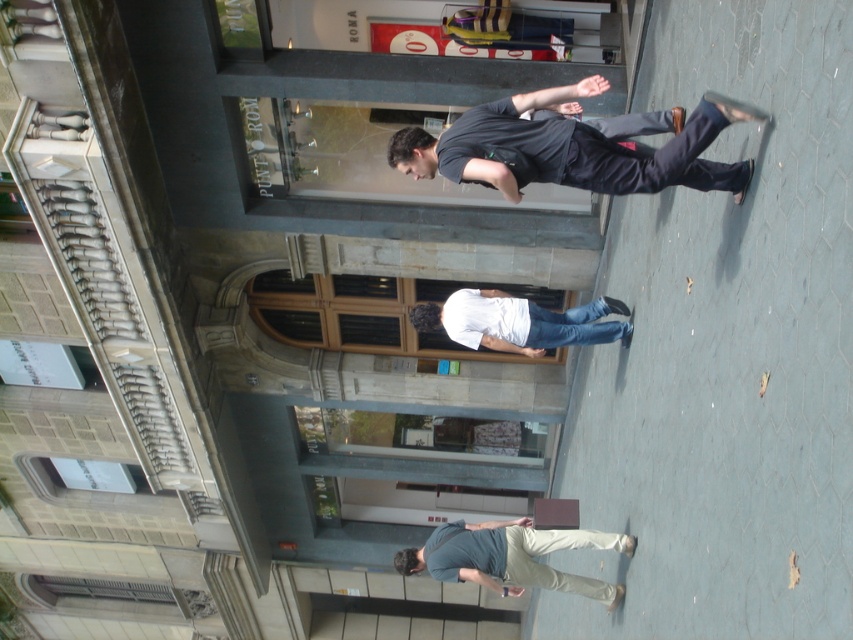
You are standing at the point marked by the coordinates point [575,147]. You want to walk to the building with the PUNTO ROMA sign. Which direction should you go?

The point [575,147] corresponds to dark blue jeans at center, so you should walk towards the building with the PUNTO ROMA sign located in the background.

You are a tailor observing a person wearing dark blue jeans at center and white matte shirt at center. Which clothing item has a greater width?

The dark blue jeans at center has a larger width than the white matte shirt at center according to the description.